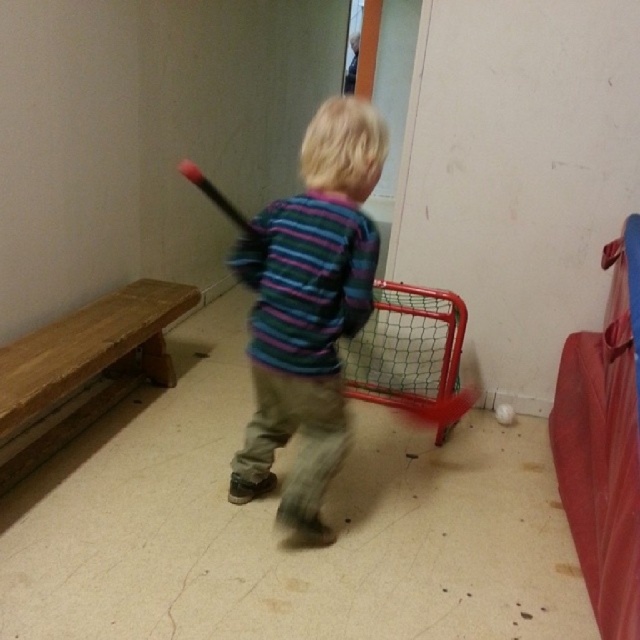
Question: Does striped fabric shirt at center have a smaller size compared to smooth plastic bat at center?

Choices:
 (A) no
 (B) yes

Answer: (A)

Question: Which point is farther to the camera?

Choices:
 (A) smooth plastic bat at center
 (B) striped fabric shirt at center

Answer: (A)

Question: Which point is closer to the camera?

Choices:
 (A) (310, 296)
 (B) (182, 160)

Answer: (A)

Question: Does striped fabric shirt at center have a smaller size compared to smooth plastic bat at center?

Choices:
 (A) yes
 (B) no

Answer: (B)

Question: From the image, what is the correct spatial relationship of striped fabric shirt at center in relation to smooth plastic bat at center?

Choices:
 (A) right
 (B) left

Answer: (A)

Question: Which point is farther to the camera?

Choices:
 (A) (284, 435)
 (B) (241, 230)

Answer: (B)